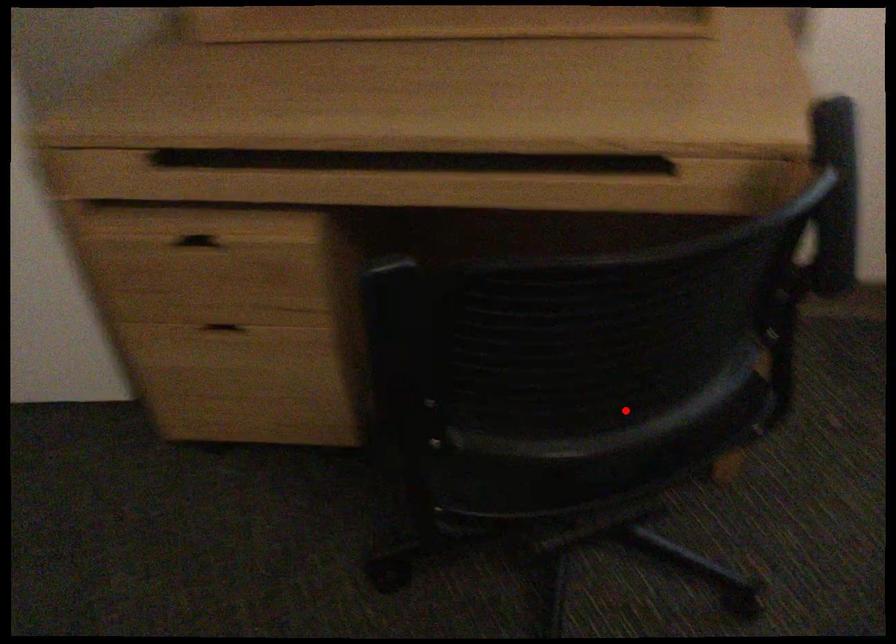
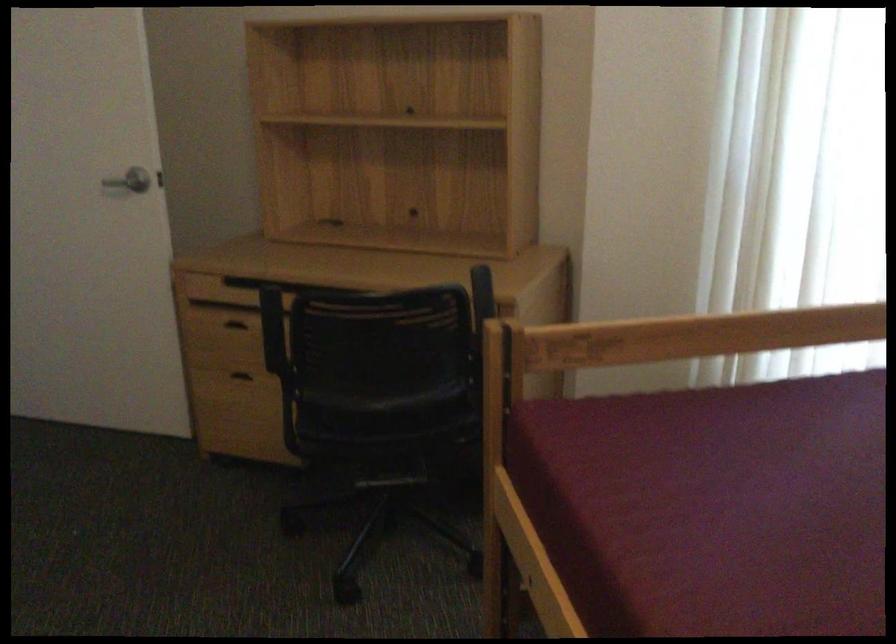
Question: A red point is marked in image1. In image2, is the corresponding 3D point closer to the camera or farther? Reply with the corresponding letter.

Choices:
 (A) The corresponding 3D point is closer.
 (B) The corresponding 3D point is farther.

Answer: (B)